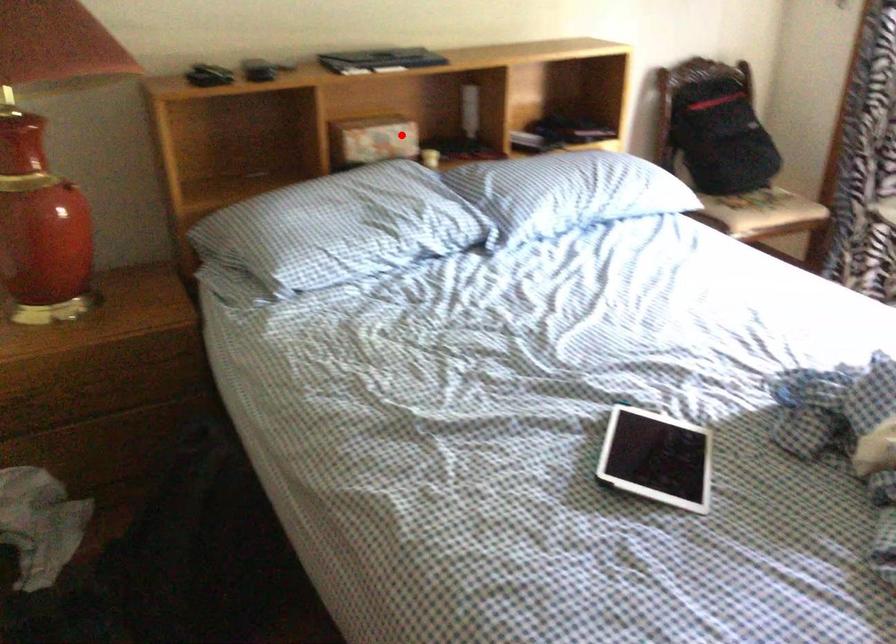
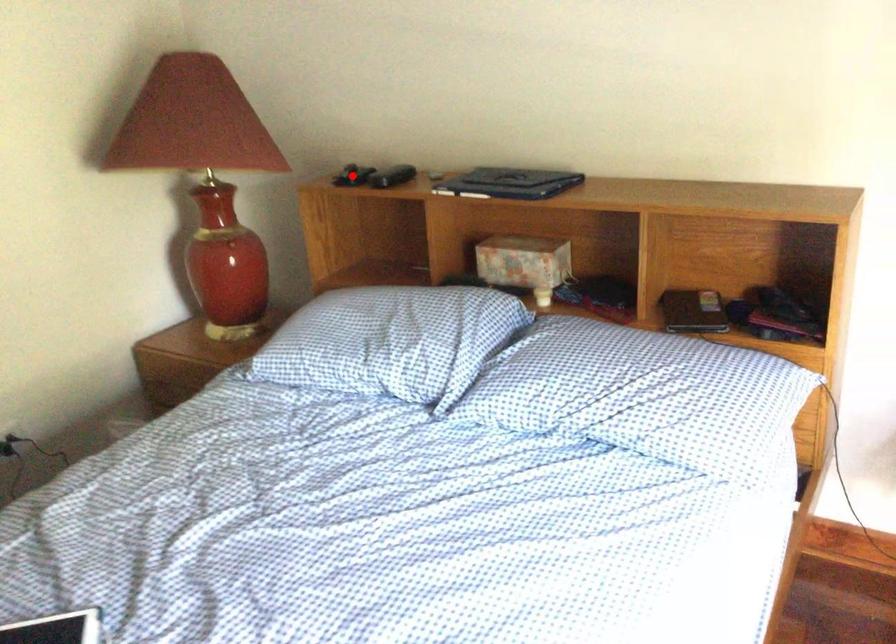
I am providing you with two images of the same scene from different viewpoints. A red point is marked on the first image and another point is marked on the second image. Is the marked point in image1 the same physical position as the marked point in image2?

No